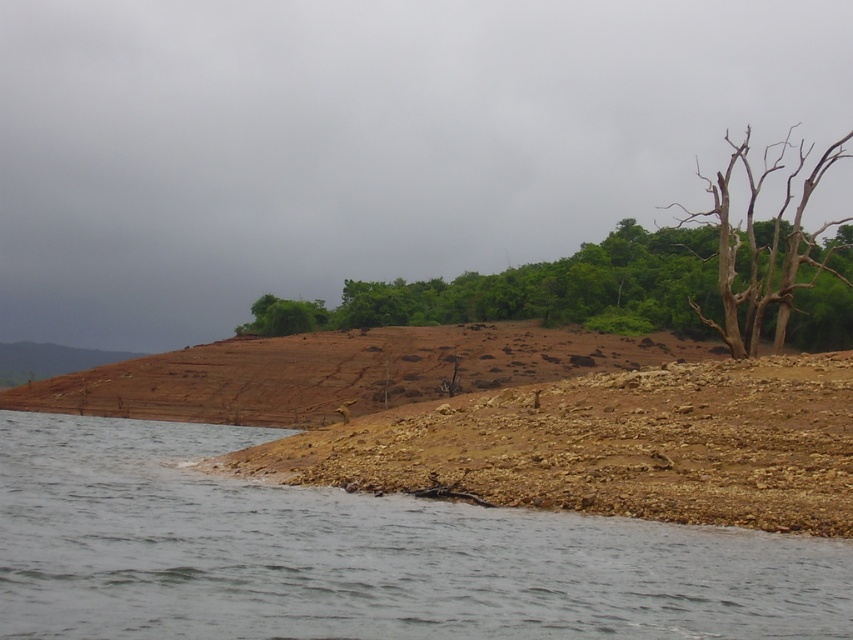
You are standing at the shoreline and want to cross to the other side. You see the gray water at lower left and the brown rough tree at center. Which one is narrower so you can cross more easily?

The gray water at lower left is thinner than the brown rough tree at center, so it is narrower and easier to cross.

You are standing at the shoreline looking out at the water and the dry land. There are two points marked in the image. Which point, point (508, 536) or point (842, 147), is closer to you?

Point (508, 536) is closer to the viewer than point (842, 147).